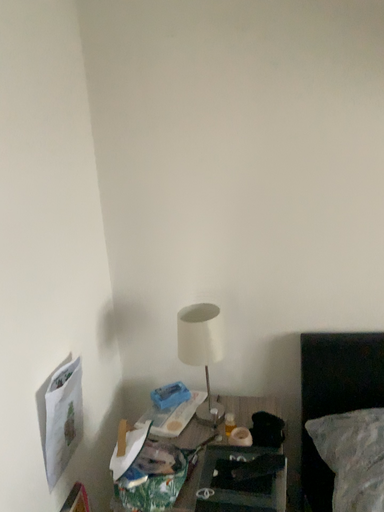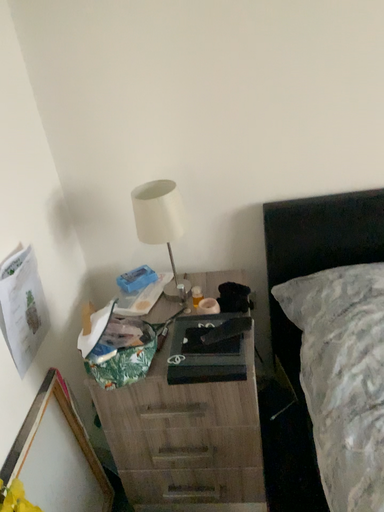
Question: Which way did the camera rotate in the video?

Choices:
 (A) rotated upward
 (B) rotated downward

Answer: (B)